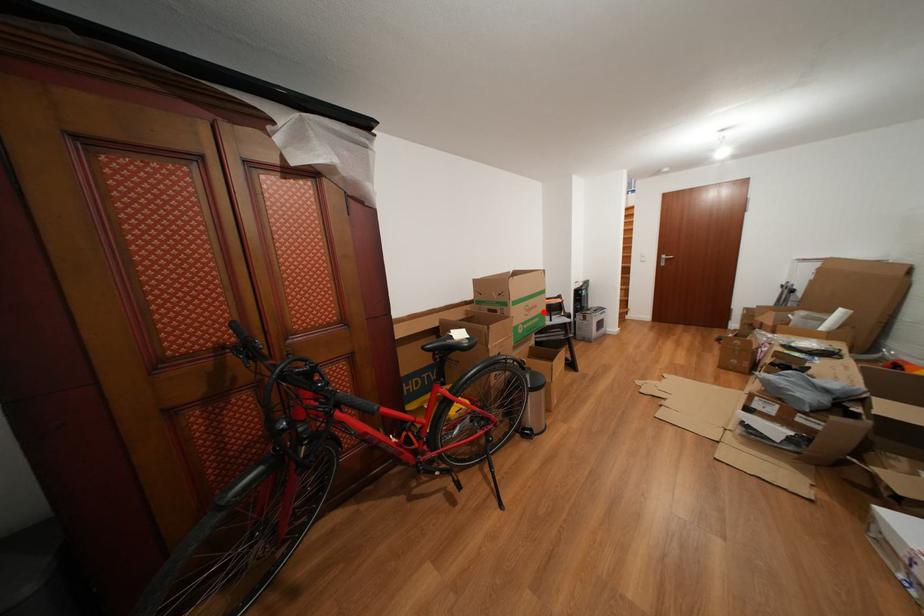
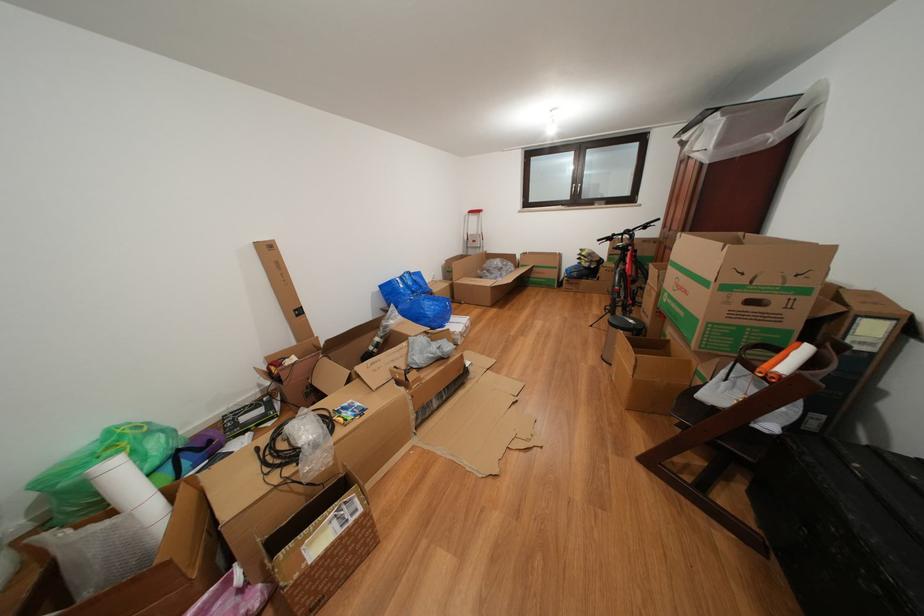
In the second image, find the point that corresponds to the highlighted location in the first image.

(694, 297)